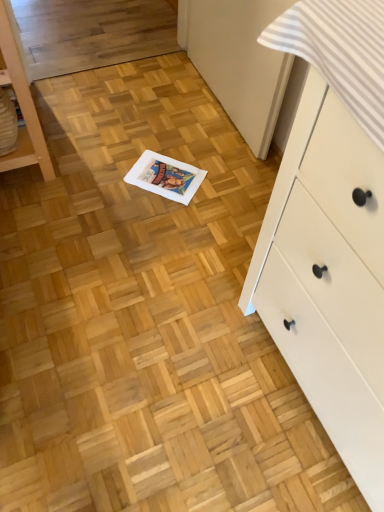
Where is `vacant space that is to the left of white wood chest of drawers at right`? The image size is (384, 512). vacant space that is to the left of white wood chest of drawers at right is located at coordinates 183,358.